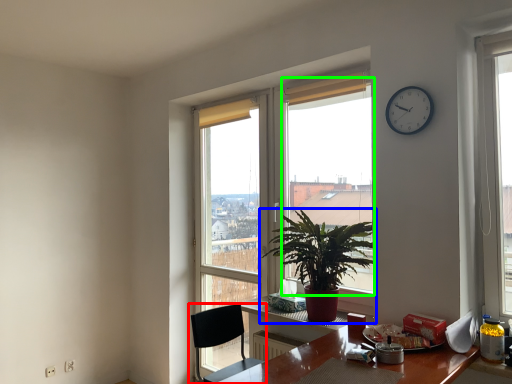
Question: Which is nearer to the chair (highlighted by a red box)? houseplant (highlighted by a blue box) or window screen (highlighted by a green box).

Choices:
 (A) houseplant
 (B) window screen

Answer: (A)